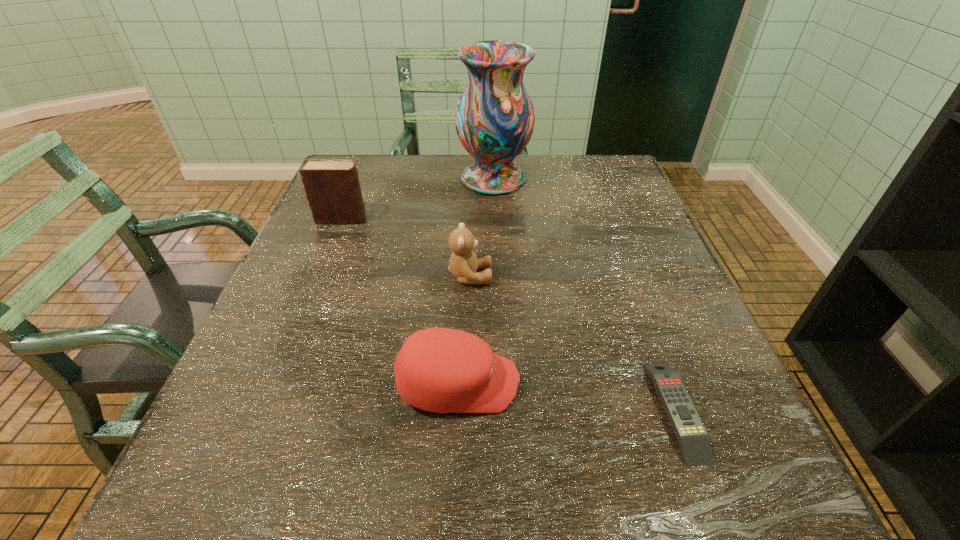
At what (x,y) coordinates should I click in order to perform the action: click on free space at the near edge of the desktop. Please return your answer as a coordinate pair (x, y). Looking at the image, I should click on (621, 469).

Where is `vacant space at the left edge`? vacant space at the left edge is located at coordinates (339, 341).

You are a GUI agent. You are given a task and a screenshot of the screen. Output one action in this format:
    pyautogui.click(x=<x>, y=<y>)
    Task: Click on the free space at the right edge of the desktop
    This screenshot has height=540, width=960.
    Given the screenshot: What is the action you would take?
    pyautogui.click(x=672, y=338)

The width and height of the screenshot is (960, 540). I want to click on free space at the far left corner of the desktop, so click(359, 156).

In order to click on vacant space at the far right corner of the desktop in this screenshot , I will do `click(623, 187)`.

Where is `free space at the near right corner`? This screenshot has height=540, width=960. free space at the near right corner is located at coordinates click(763, 498).

This screenshot has width=960, height=540. I want to click on vacant space that's between the rightmost object and the fourth tallest object, so click(x=566, y=397).

What are the coordinates of `empty location between the fourth nearest object and the cap` in the screenshot? It's located at (400, 301).

What are the coordinates of `vacant area that lies between the shortest object and the second tallest object` in the screenshot? It's located at (509, 314).

Locate an element on the screen. The height and width of the screenshot is (540, 960). vacant space in between the second shortest object and the diary is located at coordinates (400, 301).